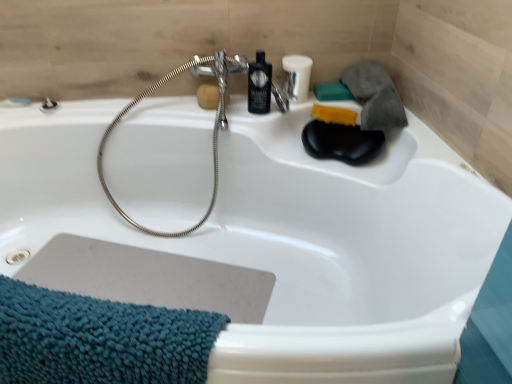
Question: Is teal matte soap at upper right, arranged as the first soap when viewed from the right, oriented towards brown sponge at upper center, positioned as the 3th soap in right-to-left order?

Choices:
 (A) yes
 (B) no

Answer: (B)

Question: From the image's perspective, is teal matte soap at upper right, which is the third soap in left-to-right order, under brown sponge at upper center, positioned as the 3th soap in right-to-left order?

Choices:
 (A) no
 (B) yes

Answer: (A)

Question: From a real-world perspective, is teal matte soap at upper right, which is the third soap in left-to-right order, on top of brown sponge at upper center, positioned as the 3th soap in right-to-left order?

Choices:
 (A) no
 (B) yes

Answer: (A)

Question: Does teal matte soap at upper right, arranged as the first soap when viewed from the right, come behind brown sponge at upper center, positioned as the first soap in left-to-right order?

Choices:
 (A) no
 (B) yes

Answer: (B)

Question: Considering the relative positions of teal matte soap at upper right, which is the third soap in left-to-right order, and brown sponge at upper center, positioned as the first soap in left-to-right order, in the image provided, is teal matte soap at upper right, which is the third soap in left-to-right order, to the right of brown sponge at upper center, positioned as the first soap in left-to-right order, from the viewer's perspective?

Choices:
 (A) yes
 (B) no

Answer: (A)

Question: Is point (192, 226) positioned closer to the camera than point (76, 336)?

Choices:
 (A) closer
 (B) farther

Answer: (B)

Question: Looking at the image, does silver metallic garden hose at upper center seem bigger or smaller compared to teal chenille towel at lower left?

Choices:
 (A) small
 (B) big

Answer: (B)

Question: In the image, is silver metallic garden hose at upper center positioned in front of or behind teal chenille towel at lower left?

Choices:
 (A) front
 (B) behind

Answer: (B)

Question: From the image's perspective, is silver metallic garden hose at upper center located above or below teal chenille towel at lower left?

Choices:
 (A) above
 (B) below

Answer: (A)

Question: Considering the positions of yellow sponge at upper right, arranged as the second soap when viewed from the left, and teal chenille towel at lower left in the image, is yellow sponge at upper right, arranged as the second soap when viewed from the left, bigger or smaller than teal chenille towel at lower left?

Choices:
 (A) big
 (B) small

Answer: (B)

Question: Is yellow sponge at upper right, placed as the 2th soap when sorted from right to left, inside the boundaries of teal chenille towel at lower left, or outside?

Choices:
 (A) inside
 (B) outside

Answer: (B)

Question: From the image's perspective, relative to teal chenille towel at lower left, is yellow sponge at upper right, arranged as the second soap when viewed from the left, above or below?

Choices:
 (A) above
 (B) below

Answer: (A)

Question: Is point (322, 117) positioned closer to the camera than point (133, 327)?

Choices:
 (A) farther
 (B) closer

Answer: (A)

Question: Is point (318, 97) closer or farther from the camera than point (74, 299)?

Choices:
 (A) farther
 (B) closer

Answer: (A)

Question: Choose the correct answer: Is teal matte soap at upper right, which is the third soap in left-to-right order, inside teal chenille towel at lower left or outside it?

Choices:
 (A) inside
 (B) outside

Answer: (B)